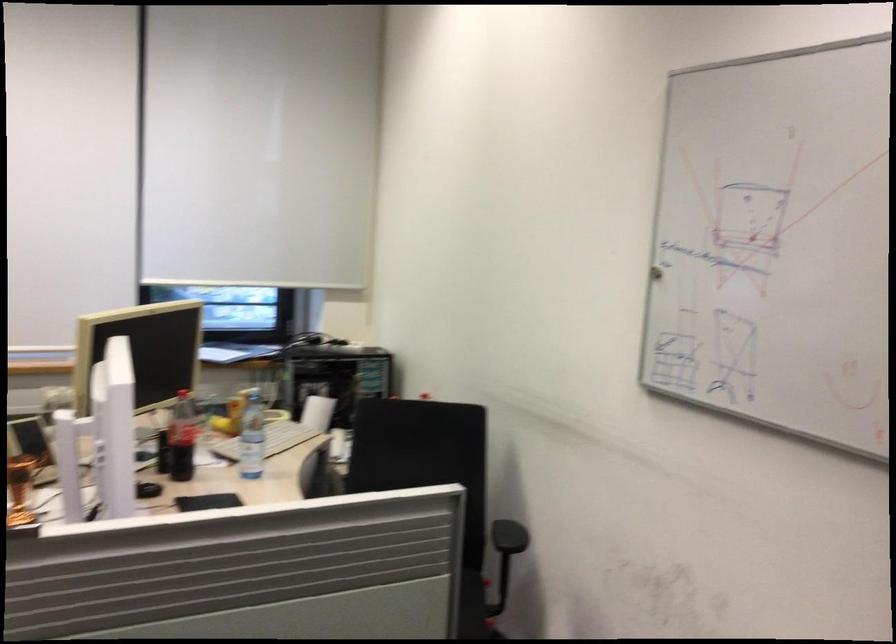
Find the location of a particular element. clear water bottle is located at coordinates pos(252,436).